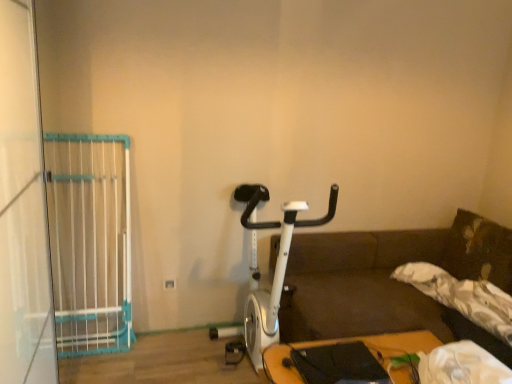
Where is `free point below white plastic gate at left (from a real-world perspective)`? This screenshot has height=384, width=512. free point below white plastic gate at left (from a real-world perspective) is located at coordinates [100, 346].